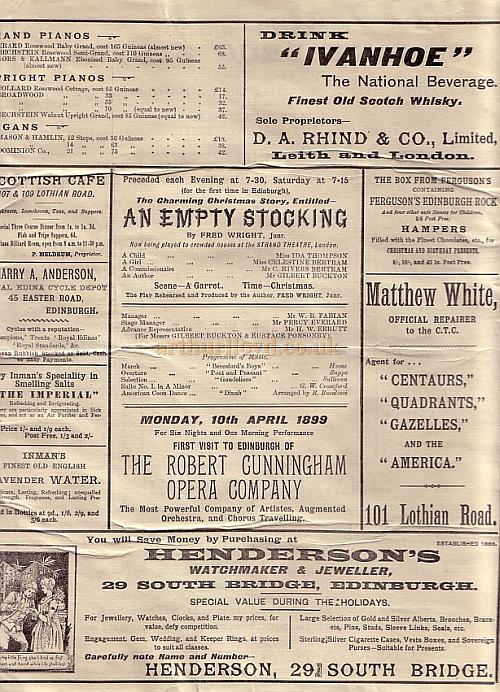
Find the location of a particular element. This screenshot has height=692, width=500. stocking is located at coordinates (276, 212).